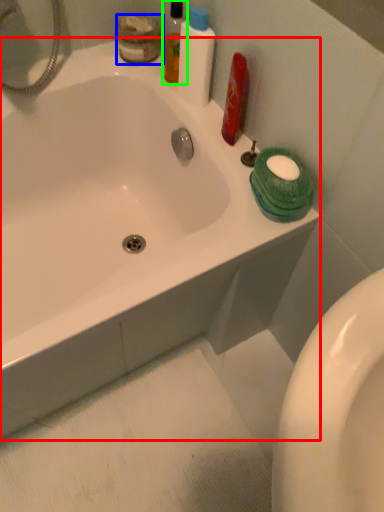
Question: Estimate the real-world distances between objects in this image. Which object is farther from bathtub (highlighted by a red box), toiletry (highlighted by a blue box) or mouthwash (highlighted by a green box)?

Choices:
 (A) toiletry
 (B) mouthwash

Answer: (A)